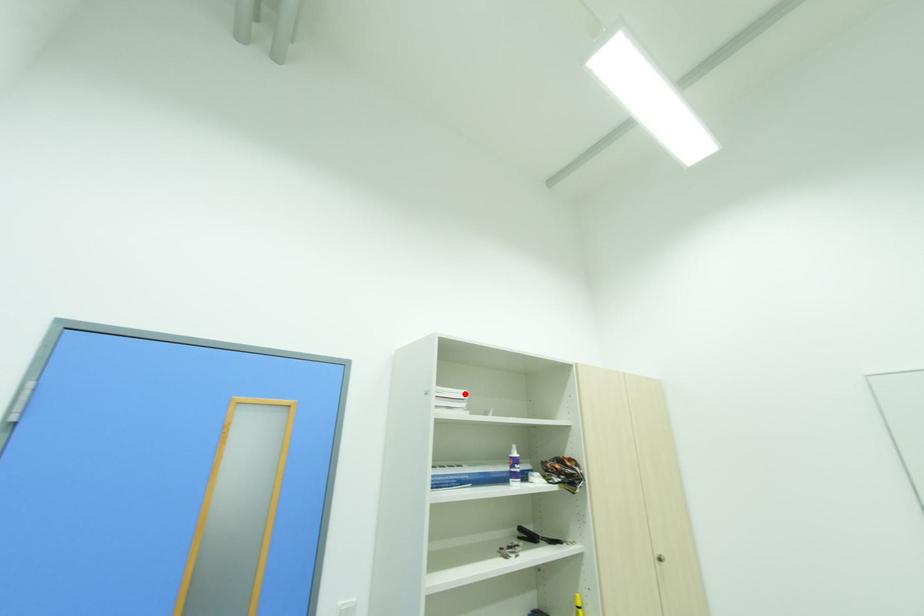
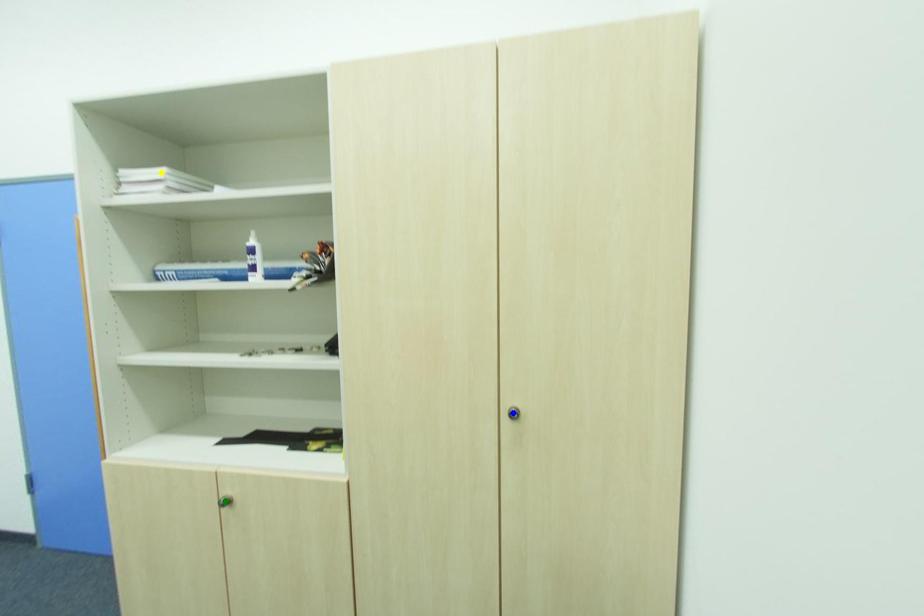
Question: I am providing you with two images of the same scene from different viewpoints. A red point is marked on the first image. You are given multiple points on the second image. Which mark in image 2 goes with the point in image 1?

Choices:
 (A) blue point
 (B) green point
 (C) yellow point

Answer: (C)